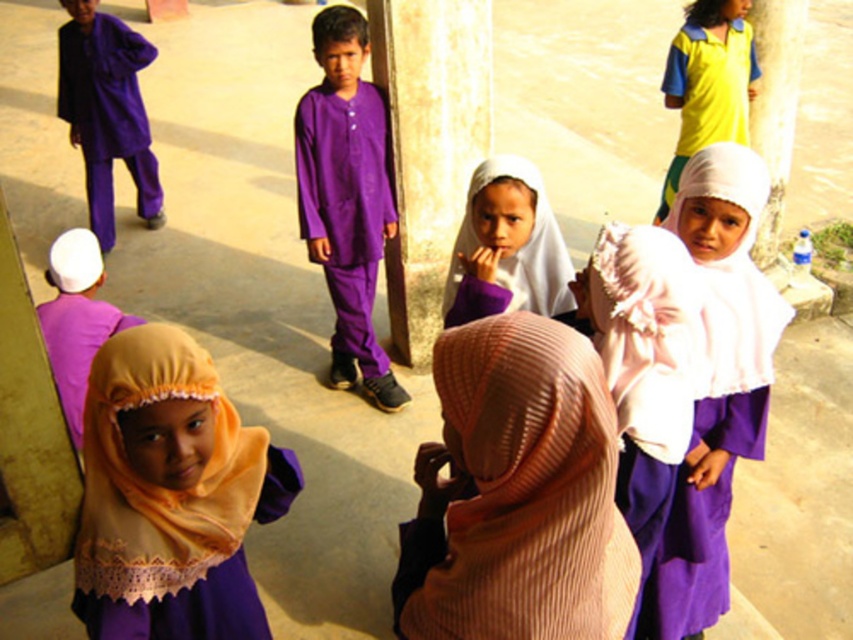
Question: Can you confirm if purple matte robe at upper left is thinner than white sheer hijab at center?

Choices:
 (A) yes
 (B) no

Answer: (B)

Question: Among these points, which one is farthest from the camera?

Choices:
 (A) (144, 177)
 (B) (496, 292)
 (C) (409, 152)
 (D) (740, 74)

Answer: (A)

Question: Does smooth concrete pillar at center have a larger size compared to purple matte robe at upper left?

Choices:
 (A) yes
 (B) no

Answer: (A)

Question: Which point appears closest to the camera in this image?

Choices:
 (A) (689, 109)
 (B) (701, 264)
 (C) (540, 593)

Answer: (C)

Question: Which point is farther from the camera taking this photo?

Choices:
 (A) (215, 512)
 (B) (395, 56)

Answer: (B)

Question: Can you confirm if matte yellow hijab at lower left is positioned above yellow cotton shirt at upper right?

Choices:
 (A) yes
 (B) no

Answer: (B)